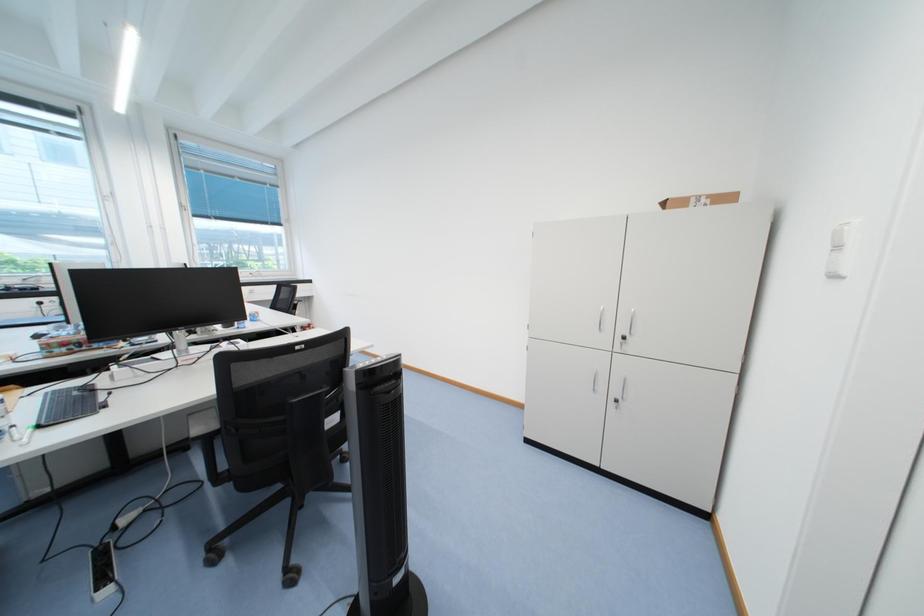
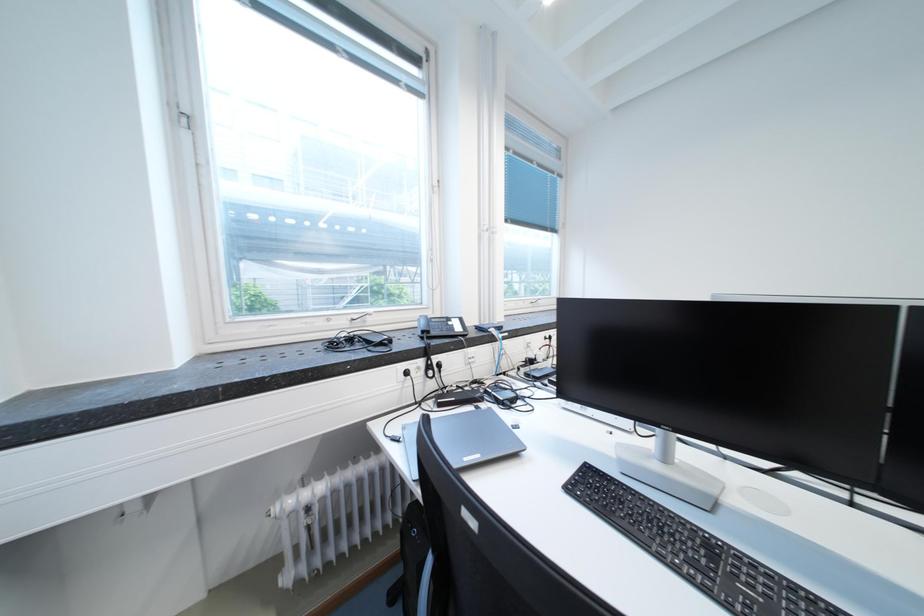
What movement of the cameraman would produce the second image?

The movement direction of the cameraman is left, forward.